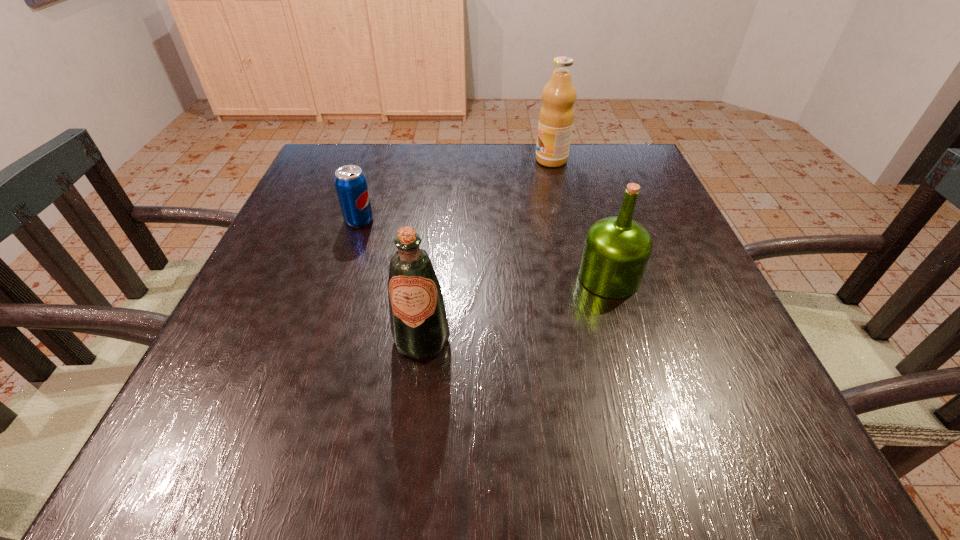
I want to click on vacant space located 0.200m on the left of the second nearest object, so click(475, 278).

Locate an element on the screen. The image size is (960, 540). free space located on the front of the second farthest object is located at coordinates (304, 389).

The height and width of the screenshot is (540, 960). In order to click on object at the far edge in this screenshot , I will do click(x=556, y=117).

Find the location of a particular element. The width and height of the screenshot is (960, 540). object at the left edge is located at coordinates (350, 182).

This screenshot has width=960, height=540. Find the location of `object positioned at the right edge`. object positioned at the right edge is located at coordinates (616, 251).

Find the location of a particular element. The image size is (960, 540). vacant space at the far edge is located at coordinates 487,155.

Locate an element on the screen. vacant area at the near edge is located at coordinates (415, 415).

Find the location of `vacant point at the left edge`. vacant point at the left edge is located at coordinates (226, 381).

In the image, there is a desktop. Identify the location of vacant area at the right edge. (655, 205).

At what (x,y) coordinates should I click in order to perform the action: click on vacant space at the far left corner of the desktop. Please return your answer as a coordinate pair (x, y). Looking at the image, I should click on (324, 181).